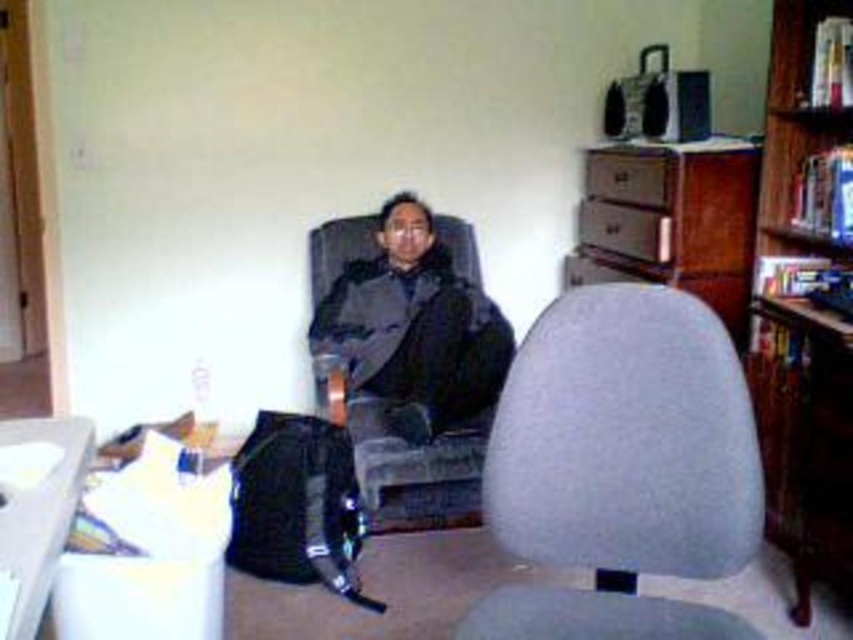
Question: Can you confirm if gray fabric swivel chair at center is wider than wooden bookshelf at upper right?

Choices:
 (A) no
 (B) yes

Answer: (B)

Question: Which point is closer to the camera?

Choices:
 (A) (825, 108)
 (B) (413, 262)
 (C) (73, 451)
 (D) (660, 300)

Answer: (C)

Question: Can you confirm if wooden bookshelf at upper right is thinner than white plastic computer desk at lower left?

Choices:
 (A) no
 (B) yes

Answer: (B)

Question: Estimate the real-world distances between objects in this image. Which object is farther from the gray fabric swivel chair at center?

Choices:
 (A) white plastic computer desk at lower left
 (B) dark gray fabric jacket at center

Answer: (B)

Question: Is wooden bookshelf at upper right thinner than white plastic computer desk at lower left?

Choices:
 (A) no
 (B) yes

Answer: (B)

Question: Considering the real-world distances, which object is closest to the wooden bookshelf at upper right?

Choices:
 (A) gray fabric swivel chair at center
 (B) white plastic computer desk at lower left

Answer: (A)